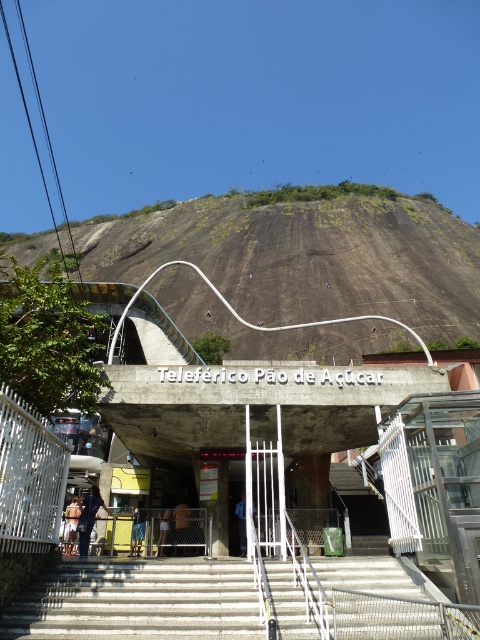
Question: Does light brown leather jacket at lower left have a lesser width compared to white fabric shirt at center?

Choices:
 (A) yes
 (B) no

Answer: (B)

Question: Estimate the real-world distances between objects in this image. Which object is closer to the light brown leather jacket at lower left?

Choices:
 (A) gray concrete stairs at center
 (B) white fabric shirt at center
 (C) blue fabric shirt at center

Answer: (C)

Question: Which point is closer to the camera?

Choices:
 (A) blue fabric shirt at center
 (B) brown fabric shirt at center
 (C) white fabric shirt at center

Answer: (B)

Question: Which is nearer to the white fabric shirt at center?

Choices:
 (A) brown fabric shirt at center
 (B) gray concrete stairs at center

Answer: (A)

Question: Is dark blue jeans at center further to camera compared to light brown leather jacket at lower left?

Choices:
 (A) no
 (B) yes

Answer: (A)

Question: Is dark blue fabric at center in front of white fabric shirt at center?

Choices:
 (A) yes
 (B) no

Answer: (B)